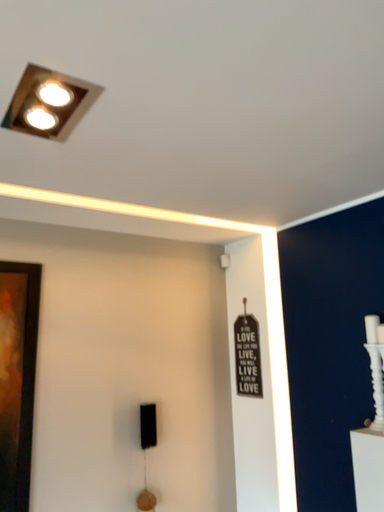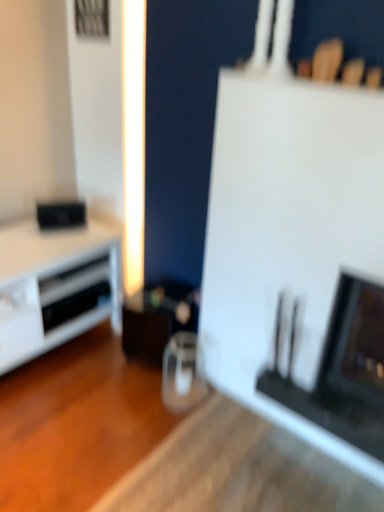
Question: How did the camera likely rotate when shooting the video?

Choices:
 (A) rotated left
 (B) rotated right

Answer: (B)